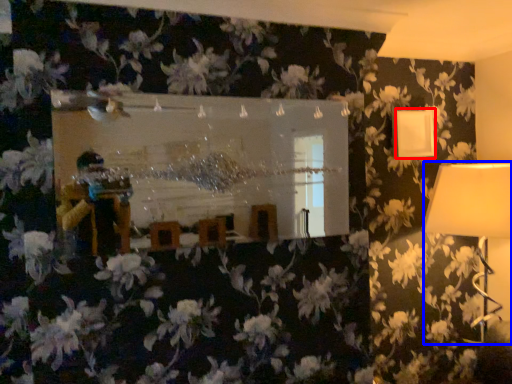
Question: Which object appears farthest to the camera in this image, lamp (highlighted by a red box) or lamp (highlighted by a blue box)?

Choices:
 (A) lamp
 (B) lamp

Answer: (A)